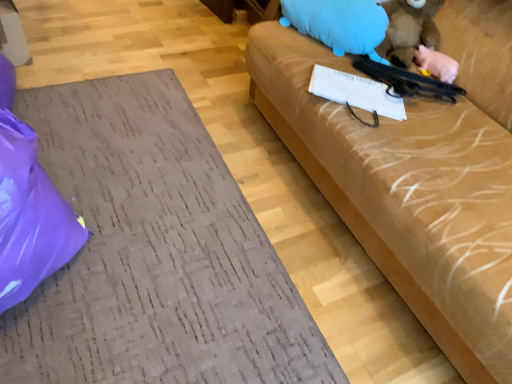
Question: Are blue plush toy at upper right, the first animal viewed from the left, and matte brown couch at right making contact?

Choices:
 (A) no
 (B) yes

Answer: (A)

Question: Does blue plush toy at upper right, the first animal viewed from the left, have a smaller size compared to matte brown couch at right?

Choices:
 (A) yes
 (B) no

Answer: (A)

Question: From the image's perspective, is blue plush toy at upper right, placed as the third animal when sorted from right to left, above matte brown couch at right?

Choices:
 (A) yes
 (B) no

Answer: (A)

Question: Can you confirm if blue plush toy at upper right, placed as the third animal when sorted from right to left, is wider than matte brown couch at right?

Choices:
 (A) yes
 (B) no

Answer: (B)

Question: Is blue plush toy at upper right, the first animal viewed from the left, far away from matte brown couch at right?

Choices:
 (A) no
 (B) yes

Answer: (A)

Question: Is the depth of blue plush toy at upper right, the first animal viewed from the left, less than that of matte brown couch at right?

Choices:
 (A) no
 (B) yes

Answer: (A)

Question: Are purple plastic bag at lower left and pink rubber pig at upper right, arranged as the 3th animal when viewed from the left, beside each other?

Choices:
 (A) no
 (B) yes

Answer: (A)

Question: From a real-world perspective, is purple plastic bag at lower left physically above pink rubber pig at upper right, arranged as the 3th animal when viewed from the left?

Choices:
 (A) yes
 (B) no

Answer: (B)

Question: Are purple plastic bag at lower left and pink rubber pig at upper right, arranged as the 3th animal when viewed from the left, far apart?

Choices:
 (A) no
 (B) yes

Answer: (B)

Question: Can you confirm if purple plastic bag at lower left is bigger than pink rubber pig at upper right, which appears as the 1th animal when viewed from the right?

Choices:
 (A) no
 (B) yes

Answer: (B)

Question: Is the position of purple plastic bag at lower left less distant than that of pink rubber pig at upper right, arranged as the 3th animal when viewed from the left?

Choices:
 (A) no
 (B) yes

Answer: (B)

Question: Could you tell me if purple plastic bag at lower left is facing pink rubber pig at upper right, which appears as the 1th animal when viewed from the right?

Choices:
 (A) yes
 (B) no

Answer: (A)

Question: Is fuzzy brown animal at upper right, positioned as the 2th animal in left-to-right order, far from blue plush toy at upper right, the first animal viewed from the left?

Choices:
 (A) yes
 (B) no

Answer: (B)